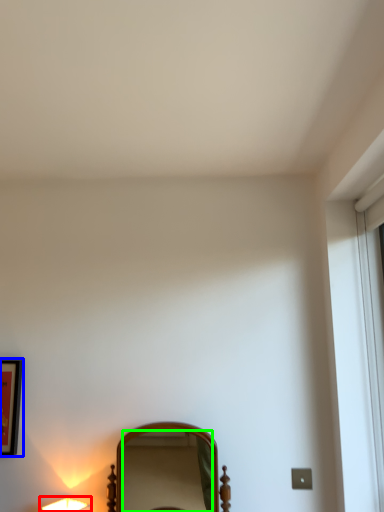
Question: Considering the real-world distances, which object is closest to lamp (highlighted by a red box)? picture frame (highlighted by a blue box) or mirror (highlighted by a green box).

Choices:
 (A) picture frame
 (B) mirror

Answer: (A)